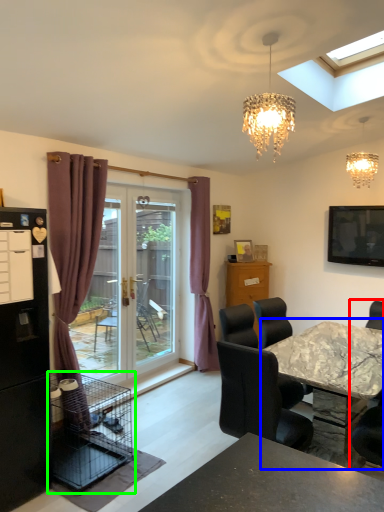
Question: Which object is positioned farthest from chair (highlighted by a red box)? Select from kitchen & dining room table (highlighted by a blue box) and bird cage (highlighted by a green box).

Choices:
 (A) kitchen & dining room table
 (B) bird cage

Answer: (B)